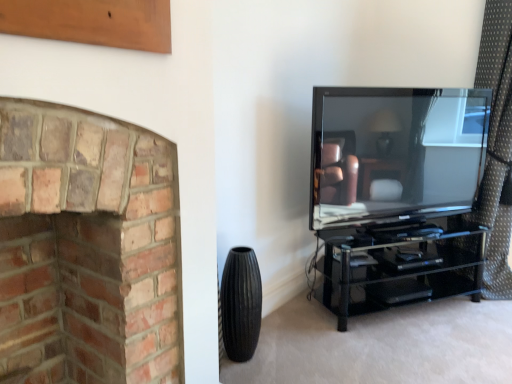
The height and width of the screenshot is (384, 512). In order to click on vacant space underneath black ribbed vase at lower center (from a real-world perspective) in this screenshot , I will do `click(248, 364)`.